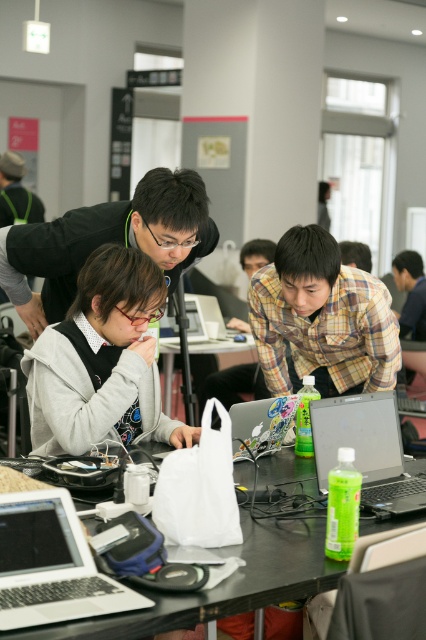
You are organizing a workshop and need to place a white plastic bag at center and a matte black laptop at center on a table. According to the scene description, where should you position the white plastic bag relative to the matte black laptop?

The white plastic bag at center should be positioned to the right of the matte black laptop at center, as described in the scene.

Based on the scene described, which object is taller between the gray matte hoodie at center and the white plastic bag at center?

The gray matte hoodie at center is much taller than the white plastic bag at center according to the description.

You are organizing a workshop and need to place a white plastic bag at center on the table. According to the image, where exactly should you position it?

The white plastic bag at center should be placed at point 0.552 on the x axis and 0.521 on the y axis as specified in the description.